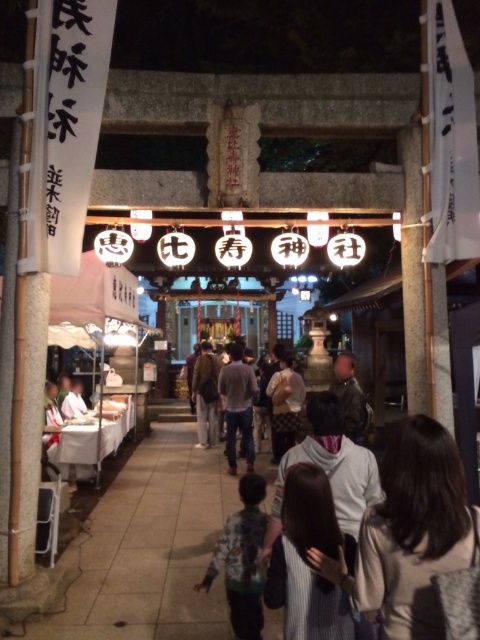
Question: Which object is the farthest from the camouflage jacket at center?

Choices:
 (A) plaid fabric shirt at center
 (B) brown leather jacket at center

Answer: (B)

Question: Which of the following is the farthest from the observer?

Choices:
 (A) (276, 452)
 (B) (228, 445)
 (C) (250, 480)

Answer: (A)

Question: Is the position of camouflage jacket at center less distant than that of dark gray sweater at center?

Choices:
 (A) no
 (B) yes

Answer: (B)

Question: Which point is closer to the camera?

Choices:
 (A) plaid fabric shirt at center
 (B) camouflage jacket at center
 (C) dark gray sweater at center
 (D) brown leather jacket at center

Answer: (B)

Question: Where is camouflage jacket at center located in relation to plaid fabric shirt at center in the image?

Choices:
 (A) right
 (B) left

Answer: (B)

Question: Does plaid fabric shirt at center have a greater width compared to brown leather jacket at center?

Choices:
 (A) yes
 (B) no

Answer: (B)